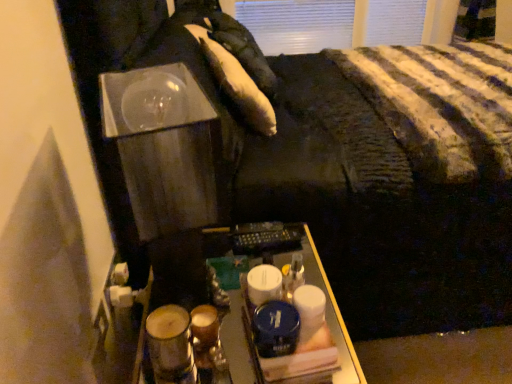
Find the location of a particular element. This screenshot has width=512, height=384. white soft pillow at upper center, which appears as the first pillow when viewed from the back is located at coordinates (241, 49).

I want to click on metallic remote control at center, so click(244, 311).

What is the approximate width of white soft pillow at upper center, which is counted as the first pillow, starting from the bottom?

white soft pillow at upper center, which is counted as the first pillow, starting from the bottom, is 22.39 centimeters in width.

Locate an element on the screen. The height and width of the screenshot is (384, 512). white soft pillow at upper center, acting as the 2th pillow starting from the bottom is located at coordinates (241, 49).

Which is closer, [248,292] or [247,92]?

Point [248,292] appears to be closer to the viewer than point [247,92].

Relative to white soft pillow at upper center, arranged as the 2th pillow when viewed from the back, is metallic remote control at center in front or behind?

In the image, metallic remote control at center appears in front of white soft pillow at upper center, arranged as the 2th pillow when viewed from the back.

Is metallic remote control at center aimed at white soft pillow at upper center, which is counted as the first pillow, starting from the bottom?

No, metallic remote control at center is not turned towards white soft pillow at upper center, which is counted as the first pillow, starting from the bottom.

Is metallic remote control at center thinner than white soft pillow at upper center, which is counted as the first pillow, starting from the bottom?

No.

Which is more to the right, white soft pillow at upper center, acting as the 2th pillow starting from the bottom, or metallic remote control at center?

Positioned to the right is white soft pillow at upper center, acting as the 2th pillow starting from the bottom.

Looking at their sizes, would you say white soft pillow at upper center, which appears as the first pillow when viewed from the back, is wider or thinner than metallic remote control at center?

Considering their sizes, white soft pillow at upper center, which appears as the first pillow when viewed from the back, looks slimmer than metallic remote control at center.

Which of these two, white soft pillow at upper center, the 1th pillow from the top, or metallic remote control at center, stands taller?

metallic remote control at center.

Does white soft pillow at upper center, acting as the 2th pillow starting from the bottom, touch metallic remote control at center?

No, white soft pillow at upper center, acting as the 2th pillow starting from the bottom, is not touching metallic remote control at center.

Which object is more forward, white soft pillow at upper center, which is counted as the first pillow, starting from the bottom, or matte brown glass at lower left?

matte brown glass at lower left is closer to the camera.

Which object is wider, white soft pillow at upper center, which is the second pillow in top-to-bottom order, or matte brown glass at lower left?

With larger width is white soft pillow at upper center, which is the second pillow in top-to-bottom order.

Is white soft pillow at upper center, which ranks as the 1th pillow in front-to-back order, facing away from matte brown glass at lower left?

No, white soft pillow at upper center, which ranks as the 1th pillow in front-to-back order, is not facing the opposite direction of matte brown glass at lower left.

From a real-world perspective, which object rests below the other?

matte brown glass at lower left, from a real-world perspective.

From a real-world perspective, which object rests below the other?

In real-world perspective, matte brown glass at lower left is lower.

Considering the sizes of white soft pillow at upper center, which appears as the first pillow when viewed from the back, and matte brown glass at lower left in the image, is white soft pillow at upper center, which appears as the first pillow when viewed from the back, wider or thinner than matte brown glass at lower left?

Considering their sizes, white soft pillow at upper center, which appears as the first pillow when viewed from the back, looks broader than matte brown glass at lower left.

Is white soft pillow at upper center, which appears as the first pillow when viewed from the back, spatially inside matte brown glass at lower left, or outside of it?

white soft pillow at upper center, which appears as the first pillow when viewed from the back, is outside matte brown glass at lower left.

From the image's perspective, is white soft pillow at upper center, the 1th pillow from the top, positioned above or below matte brown glass at lower left?

white soft pillow at upper center, the 1th pillow from the top, is above matte brown glass at lower left.

Is white soft pillow at upper center, which ranks as the 1th pillow in front-to-back order, spatially inside white soft pillow at upper center, which appears as the first pillow when viewed from the back, or outside of it?

white soft pillow at upper center, which ranks as the 1th pillow in front-to-back order, cannot be found inside white soft pillow at upper center, which appears as the first pillow when viewed from the back.

Which of these two, white soft pillow at upper center, arranged as the 2th pillow when viewed from the back, or white soft pillow at upper center, acting as the 2th pillow starting from the bottom, is wider?

Wider between the two is white soft pillow at upper center, arranged as the 2th pillow when viewed from the back.

Considering the positions of point (229, 62) and point (233, 30), is point (229, 62) closer or farther from the camera than point (233, 30)?

Clearly, point (229, 62) is closer to the camera than point (233, 30).

Is metallic remote control at center situated inside matte brown glass at lower left or outside?

metallic remote control at center is located beyond the bounds of matte brown glass at lower left.

Is metallic remote control at center oriented away from matte brown glass at lower left?

No, matte brown glass at lower left is not at the back of metallic remote control at center.

Does metallic remote control at center have a lesser width compared to matte brown glass at lower left?

No, metallic remote control at center is not thinner than matte brown glass at lower left.

Does metallic remote control at center appear on the right side of matte brown glass at lower left?

Yes, metallic remote control at center is to the right of matte brown glass at lower left.

Could you tell me if white soft pillow at upper center, the second pillow in the front-to-back sequence, is facing white soft pillow at upper center, which is the second pillow in top-to-bottom order?

No, white soft pillow at upper center, the second pillow in the front-to-back sequence, is not turned towards white soft pillow at upper center, which is the second pillow in top-to-bottom order.

Between white soft pillow at upper center, the 1th pillow from the top, and white soft pillow at upper center, which is the second pillow in top-to-bottom order, which one has more height?

white soft pillow at upper center, the 1th pillow from the top, is taller.

Identify the location of pillow on the left of the white soft pillow at upper center, which is counted as the first pillow, starting from the bottom. (241, 49).

Does white soft pillow at upper center, the second pillow in the front-to-back sequence, appear on the left side of white soft pillow at upper center, arranged as the 2th pillow when viewed from the back?

Yes, white soft pillow at upper center, the second pillow in the front-to-back sequence, is to the left of white soft pillow at upper center, arranged as the 2th pillow when viewed from the back.

From the image's perspective, which pillow is the 1st one above the metallic remote control at center? Please provide its 2D coordinates.

[(240, 87)]

The image size is (512, 384). Identify the location of furniture that is in front of the white soft pillow at upper center, the second pillow in the front-to-back sequence. (244, 311).

Which object lies nearer to the anchor point white soft pillow at upper center, which ranks as the 1th pillow in front-to-back order, matte brown glass at lower left or white soft pillow at upper center, which appears as the first pillow when viewed from the back?

white soft pillow at upper center, which appears as the first pillow when viewed from the back.

Which object lies nearer to the anchor point matte brown glass at lower left, white soft pillow at upper center, which is counted as the first pillow, starting from the bottom, or white soft pillow at upper center, the 1th pillow from the top?

The object closer to matte brown glass at lower left is white soft pillow at upper center, which is counted as the first pillow, starting from the bottom.

Estimate the real-world distances between objects in this image. Which object is further from matte brown glass at lower left, metallic remote control at center or white soft pillow at upper center, the second pillow in the front-to-back sequence?

white soft pillow at upper center, the second pillow in the front-to-back sequence, is positioned further to the anchor matte brown glass at lower left.

Estimate the real-world distances between objects in this image. Which object is further from metallic remote control at center, matte brown glass at lower left or white soft pillow at upper center, acting as the 2th pillow starting from the bottom?

white soft pillow at upper center, acting as the 2th pillow starting from the bottom, lies further to metallic remote control at center than the other object.

Looking at the image, which one is located closer to white soft pillow at upper center, the 1th pillow from the top, metallic remote control at center or white soft pillow at upper center, which is the second pillow in top-to-bottom order?

Among the two, white soft pillow at upper center, which is the second pillow in top-to-bottom order, is located nearer to white soft pillow at upper center, the 1th pillow from the top.

In the scene shown: Considering their positions, is white soft pillow at upper center, which appears as the first pillow when viewed from the back, positioned further to metallic remote control at center than matte brown glass at lower left?

The object further to metallic remote control at center is white soft pillow at upper center, which appears as the first pillow when viewed from the back.

Based on their spatial positions, is metallic remote control at center or matte brown glass at lower left further from white soft pillow at upper center, which is counted as the first pillow, starting from the bottom?

matte brown glass at lower left is positioned further to the anchor white soft pillow at upper center, which is counted as the first pillow, starting from the bottom.

Based on their spatial positions, is white soft pillow at upper center, the 1th pillow from the top, or matte brown glass at lower left closer to white soft pillow at upper center, which is counted as the first pillow, starting from the bottom?

white soft pillow at upper center, the 1th pillow from the top, lies closer to white soft pillow at upper center, which is counted as the first pillow, starting from the bottom, than the other object.

This screenshot has height=384, width=512. Find the location of `pillow between white soft pillow at upper center, which appears as the first pillow when viewed from the back, and metallic remote control at center vertically`. pillow between white soft pillow at upper center, which appears as the first pillow when viewed from the back, and metallic remote control at center vertically is located at coordinates (240, 87).

Find the location of `beverage that lies between white soft pillow at upper center, acting as the 2th pillow starting from the bottom, and metallic remote control at center from top to bottom`. beverage that lies between white soft pillow at upper center, acting as the 2th pillow starting from the bottom, and metallic remote control at center from top to bottom is located at coordinates (170, 345).

The height and width of the screenshot is (384, 512). What are the coordinates of `beverage between white soft pillow at upper center, which is the second pillow in top-to-bottom order, and metallic remote control at center from top to bottom` in the screenshot? It's located at (170, 345).

Identify the location of pillow between white soft pillow at upper center, the 1th pillow from the top, and matte brown glass at lower left vertically. Image resolution: width=512 pixels, height=384 pixels. (240, 87).